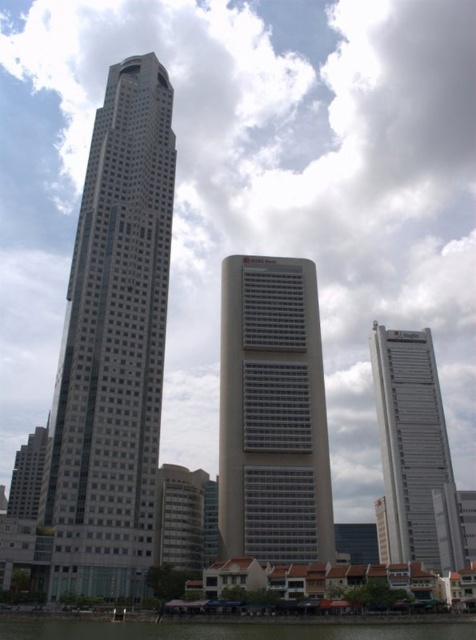
Consider the image. You are a city planner trying to install a new 30 meter long walkway between the gray concrete building at center and the white glass tower at right. Based on the scene, will the walkway fit between them?

The gray concrete building at center is 29.74 meters from the white glass tower at right. The walkway is 30 meters long, so it will be slightly too long to fit between them.

You are standing at the center of the city square, which is located at coordinate point 0.5, 0.5. You want to go to the gray glass skyscraper at left. In which direction should you walk?

The gray glass skyscraper at left is located at coordinate point (x=113, y=346), which is northeast of the city square at (x=238, y=320). Therefore, you should walk northeast to reach it.

You are standing on a balcony of the tallest skyscraper on the left. You see the gray concrete building at center and the green water at lower center. Which one is closer to you?

The gray concrete building at center is closer to you because the green water at lower center is behind it.